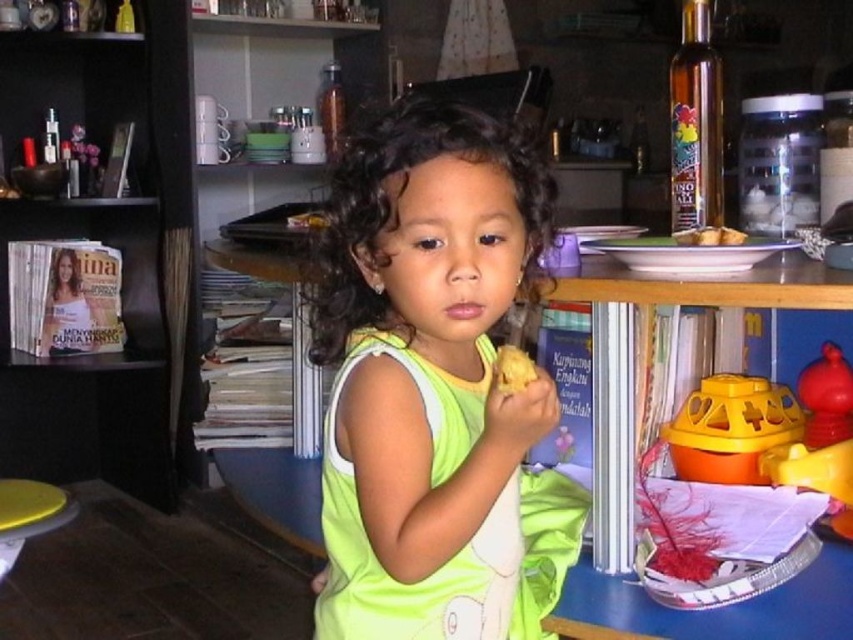
Is black wood bookshelf at left shorter than rubberized red toy at right?

No.

Who is taller, black wood bookshelf at left or rubberized red toy at right?

black wood bookshelf at left is taller.

Who is more distant from viewer, (x=164, y=232) or (x=837, y=486)?

The point (x=164, y=232) is behind.

Where is `black wood bookshelf at left`? Image resolution: width=853 pixels, height=640 pixels. black wood bookshelf at left is located at coordinates (122, 260).

Describe the element at coordinates (821, 436) in the screenshot. Image resolution: width=853 pixels, height=640 pixels. I see `rubberized red toy at right` at that location.

Between point (801, 385) and point (732, 234), which one is positioned in front?

Point (732, 234) is more forward.

Between point (781, 477) and point (692, 230), which one is positioned in front?

Point (692, 230)

Where is `rubberized red toy at right`? This screenshot has height=640, width=853. rubberized red toy at right is located at coordinates (821, 436).

Between green fabric dress at center and yellow crumbly bread at center, which one appears on the left side from the viewer's perspective?

green fabric dress at center is more to the left.

What do you see at coordinates (434, 387) in the screenshot?
I see `green fabric dress at center` at bounding box center [434, 387].

This screenshot has height=640, width=853. What are the coordinates of `green fabric dress at center` in the screenshot? It's located at (434, 387).